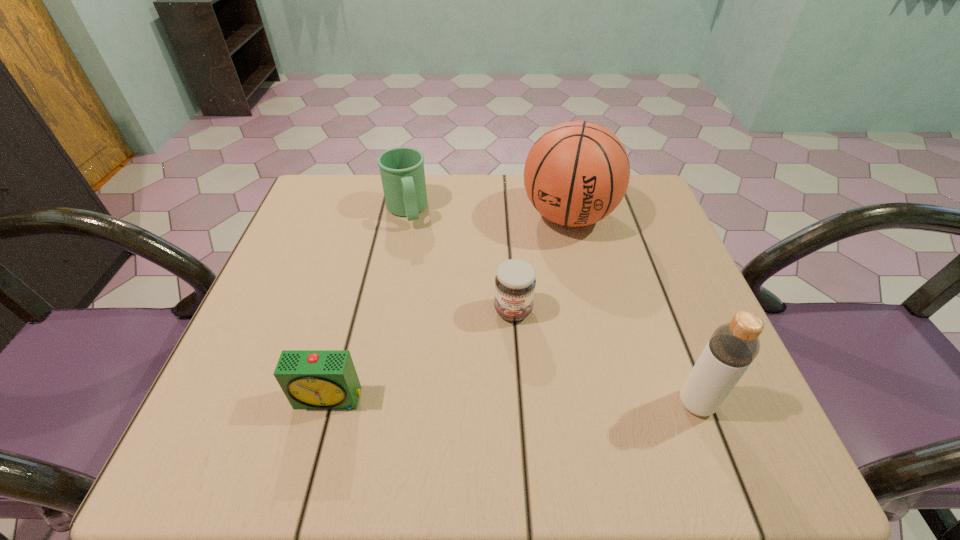
This screenshot has height=540, width=960. I want to click on bottle at the right edge, so click(x=733, y=346).

The width and height of the screenshot is (960, 540). What are the coordinates of `basketball located at the right edge` in the screenshot? It's located at (577, 173).

Identify the location of object situated at the near left corner. (311, 379).

Locate an element on the screen. The height and width of the screenshot is (540, 960). object located at the far right corner is located at coordinates (577, 173).

Identify the location of object present at the near right corner. (733, 346).

You are a GUI agent. You are given a task and a screenshot of the screen. Output one action in this format:
    pyautogui.click(x=<x>, y=<y>)
    Task: Click on the vacant space at the far edge
    
    Given the screenshot: What is the action you would take?
    pyautogui.click(x=457, y=199)

At what (x,y) coordinates should I click in order to perform the action: click on free space at the near edge. Please return your answer as a coordinate pair (x, y). This screenshot has width=960, height=540. Looking at the image, I should click on (653, 402).

Locate an element on the screen. free space at the left edge of the desktop is located at coordinates (320, 312).

The width and height of the screenshot is (960, 540). Identify the location of free region at the right edge. (705, 325).

At what (x,y) coordinates should I click in order to perform the action: click on free region at the near left corner of the desktop. Please return your answer as a coordinate pair (x, y). The width and height of the screenshot is (960, 540). Looking at the image, I should click on (276, 393).